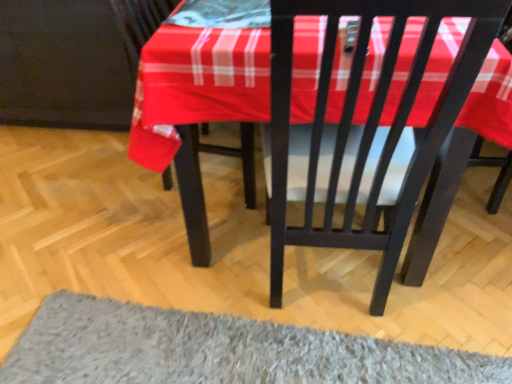
The height and width of the screenshot is (384, 512). Find the location of `empty space that is ontop of gray textured rug at lower center (from a real-world perspective)`. empty space that is ontop of gray textured rug at lower center (from a real-world perspective) is located at coordinates (249, 357).